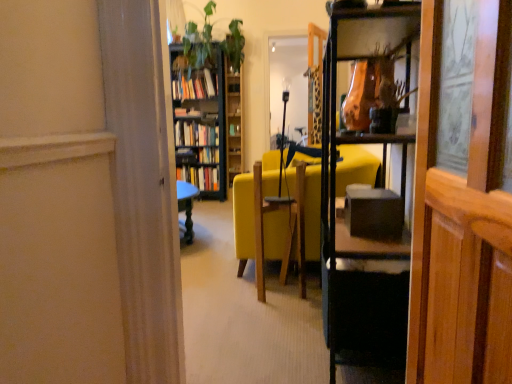
Question: Based on their sizes in the image, would you say wooden bookshelf at upper center is bigger or smaller than hardcover book at center, the third book positioned from the top?

Choices:
 (A) big
 (B) small

Answer: (A)

Question: Is wooden bookshelf at upper center wider or thinner than hardcover book at center, the third book positioned from the top?

Choices:
 (A) thin
 (B) wide

Answer: (A)

Question: Which object is the farthest from the hardcover books at center, which ranks as the first book in top-to-bottom order?

Choices:
 (A) wooden bookshelf at upper center
 (B) hardcover books at center, which appears as the second book when ordered from the bottom
 (C) hardcover book at center, marked as the 1th book in a bottom-to-top arrangement
 (D) black glossy table at center
 (E) yellow fabric chair at center

Answer: (D)

Question: Which of these objects is positioned closest to the hardcover books at center, the second book positioned from the top?

Choices:
 (A) wooden swivel chair at center
 (B) green leafy plant at upper center
 (C) hardcover book at center, the third book positioned from the top
 (D) yellow fabric chair at center
 (E) wooden bookcase at center

Answer: (E)